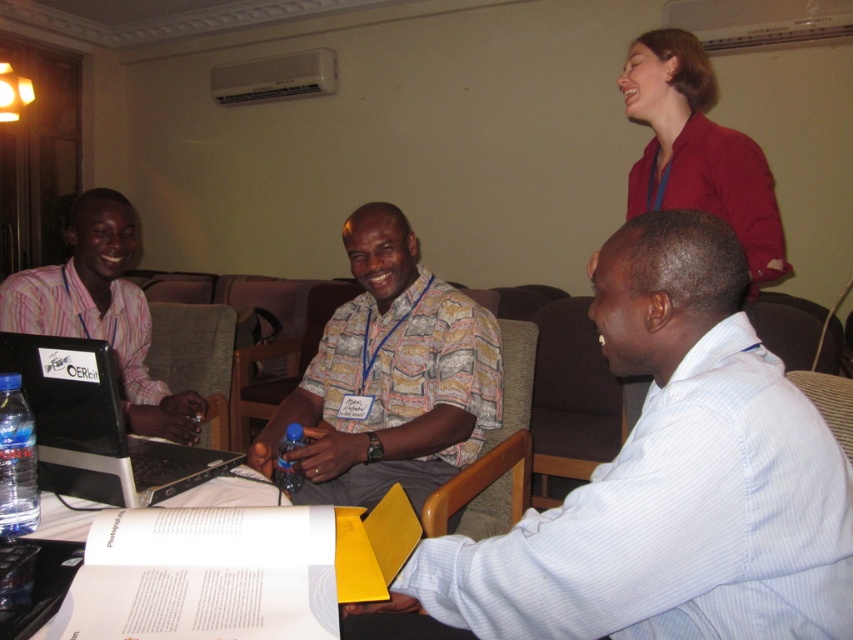
You are organizing a presentation and need to retrieve the transparent plastic bottle at lower left. However, the matte pink shirt at left is blocking your path. Is the bottle accessible without moving the shirt?

The transparent plastic bottle at lower left is behind the matte pink shirt at left, so you cannot access the transparent plastic bottle at lower left without moving the matte pink shirt at left.

You are a photographer trying to capture a closeup of the blue plastic bottle at center without including the red matte jacket at upper right in the frame. Is this possible given their positions?

The red matte jacket at upper right is in front of the blue plastic bottle at center, so it would block the view. Therefore, capturing a closeup of the blue plastic bottle at center without including the red matte jacket at upper right is not possible.

You are an office assistant who needs to deliver a document to the person wearing the red matte jacket at upper right. The document is currently on the table with the blue plastic bottle at center. Can you hand the document directly to them without moving from your current position?

The red matte jacket at upper right is located above the blue plastic bottle at center, meaning the person wearing the red matte jacket at upper right is seated directly behind or above the blue plastic bottle at center. Since you are at the table where the blue plastic bottle at center is, you would need to move towards the upper right area to reach them, so you cannot hand the document directly without moving.